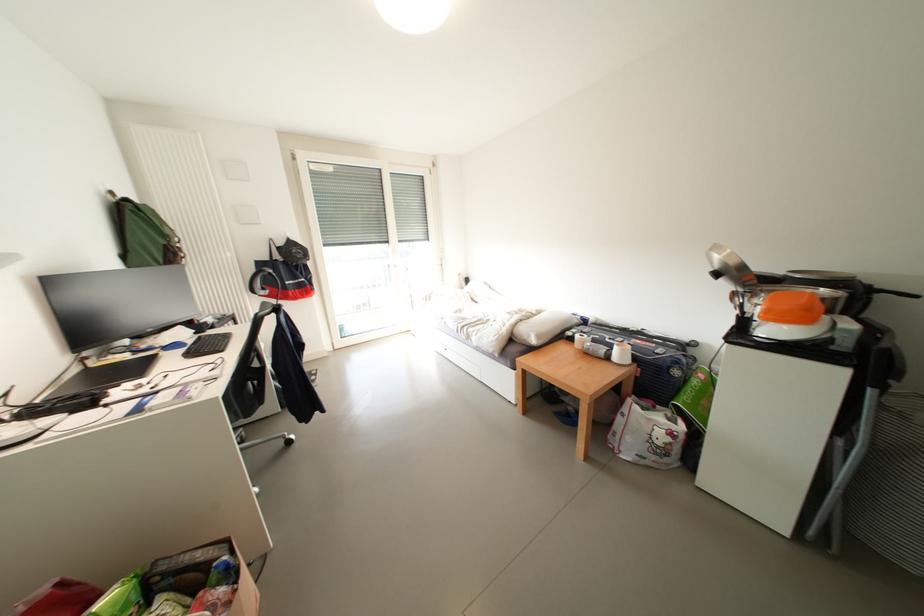
What do you see at coordinates (647, 435) in the screenshot?
I see `the white tote bag` at bounding box center [647, 435].